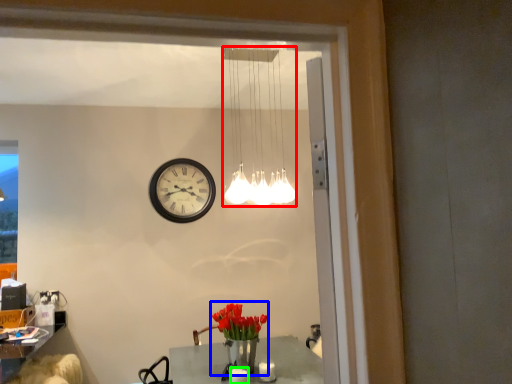
Question: Which is farther away from lamp (highlighted by a red box)? floral arrangement (highlighted by a blue box) or candle (highlighted by a green box)?

Choices:
 (A) floral arrangement
 (B) candle

Answer: (B)